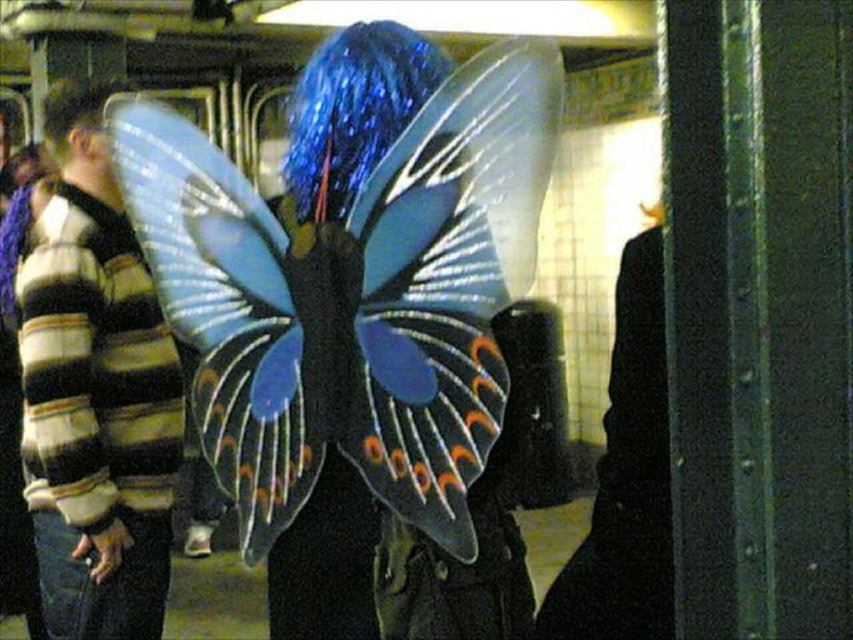
From the picture: Between translucent plastic butterfly at center and blue glittery hair at upper left, which one is positioned higher?

blue glittery hair at upper left is higher up.

Does translucent plastic butterfly at center have a lesser width compared to blue glittery hair at upper left?

Incorrect, translucent plastic butterfly at center's width is not less than blue glittery hair at upper left's.

Is point (468, 252) farther from viewer compared to point (78, 97)?

No, (468, 252) is closer to viewer.

Where is `translucent plastic butterfly at center`? This screenshot has height=640, width=853. translucent plastic butterfly at center is located at coordinates (354, 296).

Is point (210, 380) farther from viewer compared to point (154, 333)?

No.

Consider the image. Who is shorter, translucent plastic butterfly at center or striped wool sweater at left?

Standing shorter between the two is translucent plastic butterfly at center.

Describe the element at coordinates (354, 296) in the screenshot. I see `translucent plastic butterfly at center` at that location.

This screenshot has height=640, width=853. Identify the location of translucent plastic butterfly at center. (354, 296).

Is striped wool sweater at left to the left of blue glittery hair at upper left from the viewer's perspective?

Incorrect, striped wool sweater at left is not on the left side of blue glittery hair at upper left.

Based on the photo, which of these two, striped wool sweater at left or blue glittery hair at upper left, stands taller?

Standing taller between the two is striped wool sweater at left.

The width and height of the screenshot is (853, 640). In order to click on striped wool sweater at left in this screenshot , I will do `click(96, 394)`.